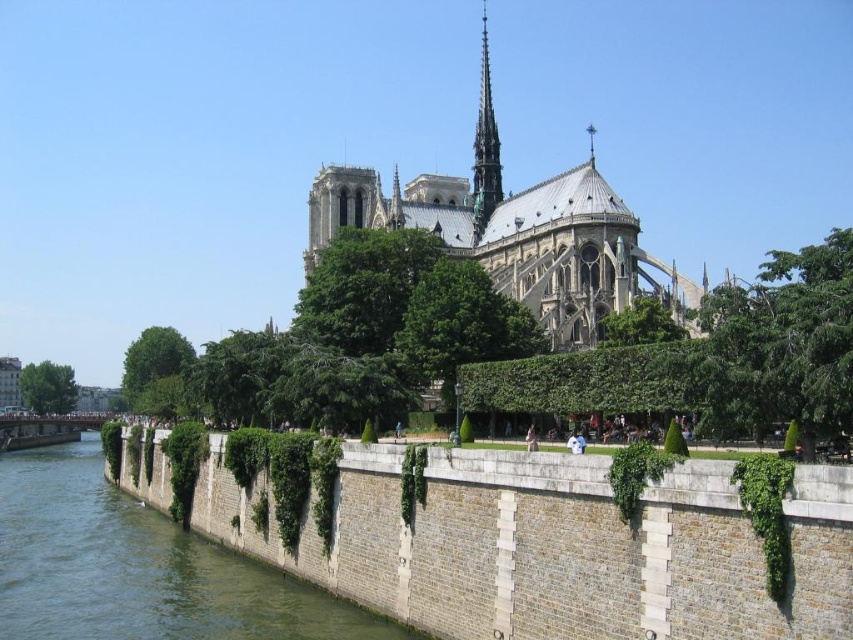
You are a tourist standing on the stone embankment near the Seine River, looking at the gray stone wall at lower left and the green stone wall at lower left. Which wall is higher?

The gray stone wall at lower left is taller than the green stone wall at lower left.

You are standing on the stone embankment near the Seine River and see the gray stone wall at lower left and the green stone wall at lower left. Which wall is closer to you?

The gray stone wall at lower left is positioned over the green stone wall at lower left, meaning it is closer to you.